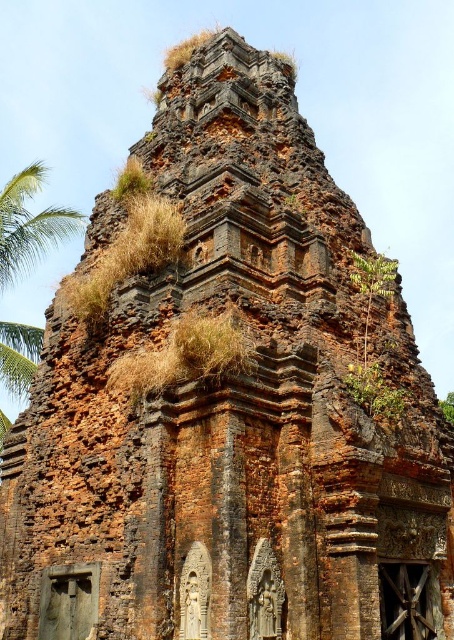
You are standing at the base of the ancient stone structure and looking up. Which direction should you look to see the green leafy palm tree at upper left?

The green leafy palm tree at upper left is located at point (29,224), so you should look to the upper left direction to see it.

You are an archaeologist examining the ancient stone structure. You notice two green leafy plants growing on the upper levels of the temple ruin. Which one is closer to you, the green leafy palm tree at upper left or the green leafy plant at upper right?

The green leafy palm tree at upper left is closer to you because the green leafy plant at upper right is positioned behind it.